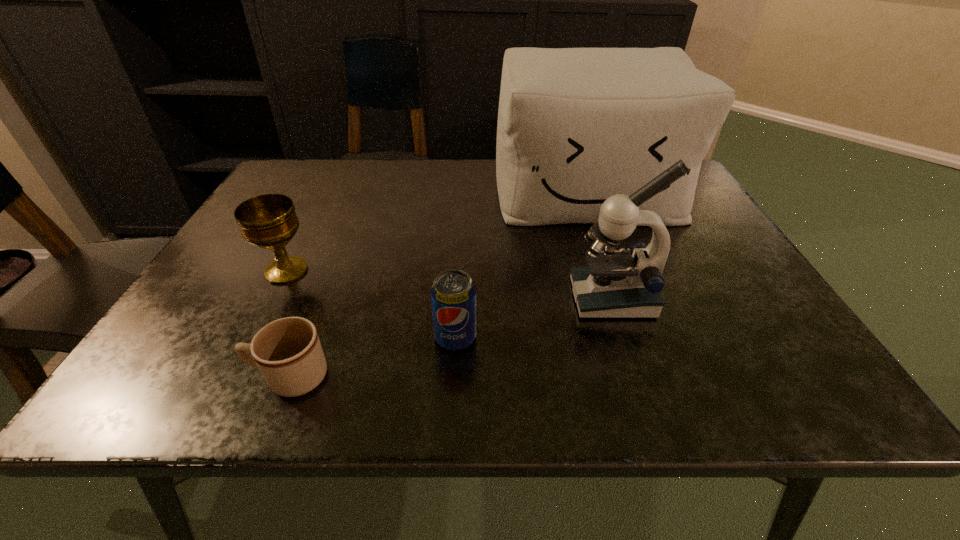
Where is `free space that satisfies the following two spatial constraints: 1. on the side of the mug with the handle; 2. on the front side of the chalice`? The width and height of the screenshot is (960, 540). free space that satisfies the following two spatial constraints: 1. on the side of the mug with the handle; 2. on the front side of the chalice is located at coordinates (331, 271).